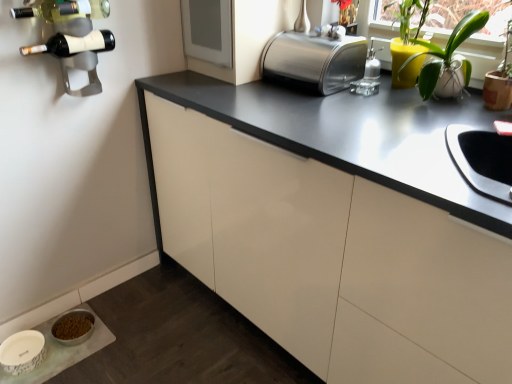
Question: From the image's perspective, is metallic wine rack at upper left over white ceramic pot at upper right?

Choices:
 (A) yes
 (B) no

Answer: (B)

Question: Would you say white ceramic pot at upper right is part of metallic wine rack at upper left's contents?

Choices:
 (A) no
 (B) yes

Answer: (A)

Question: Is metallic wine rack at upper left directly adjacent to white ceramic pot at upper right?

Choices:
 (A) no
 (B) yes

Answer: (A)

Question: Is metallic wine rack at upper left looking in the opposite direction of white ceramic pot at upper right?

Choices:
 (A) yes
 (B) no

Answer: (B)

Question: From a real-world perspective, does metallic wine rack at upper left sit lower than white ceramic pot at upper right?

Choices:
 (A) yes
 (B) no

Answer: (A)

Question: From a real-world perspective, is metallic wine rack at upper left physically above white ceramic pot at upper right?

Choices:
 (A) no
 (B) yes

Answer: (A)

Question: Considering the relative positions of white ceramic pot at upper right and metallic wine rack at upper left in the image provided, is white ceramic pot at upper right in front of metallic wine rack at upper left?

Choices:
 (A) no
 (B) yes

Answer: (B)

Question: Is white ceramic pot at upper right surrounding metallic wine rack at upper left?

Choices:
 (A) yes
 (B) no

Answer: (B)

Question: Does white ceramic pot at upper right have a larger size compared to metallic wine rack at upper left?

Choices:
 (A) yes
 (B) no

Answer: (A)

Question: Considering the relative positions of white ceramic pot at upper right and metallic wine rack at upper left in the image provided, is white ceramic pot at upper right behind metallic wine rack at upper left?

Choices:
 (A) yes
 (B) no

Answer: (B)

Question: Considering the relative sizes of white ceramic pot at upper right and metallic wine rack at upper left in the image provided, is white ceramic pot at upper right shorter than metallic wine rack at upper left?

Choices:
 (A) yes
 (B) no

Answer: (A)

Question: Is white ceramic pot at upper right taller than metallic wine rack at upper left?

Choices:
 (A) yes
 (B) no

Answer: (B)

Question: Is the depth of metallic wine rack at upper left less than that of matte black wine bottle at upper left, arranged as the 1th wine bottle when ordered from the bottom?

Choices:
 (A) yes
 (B) no

Answer: (B)